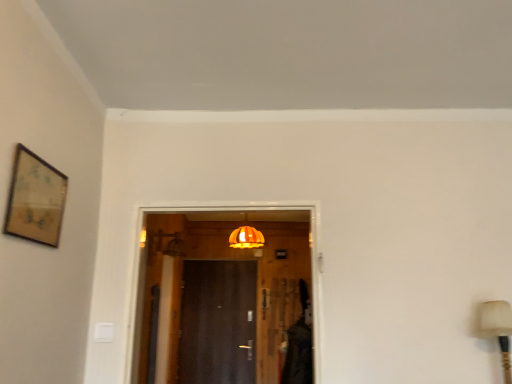
This screenshot has width=512, height=384. What are the coordinates of `vacant area on top of dark wood door at center (from a real-world perspective)` in the screenshot? It's located at (212, 262).